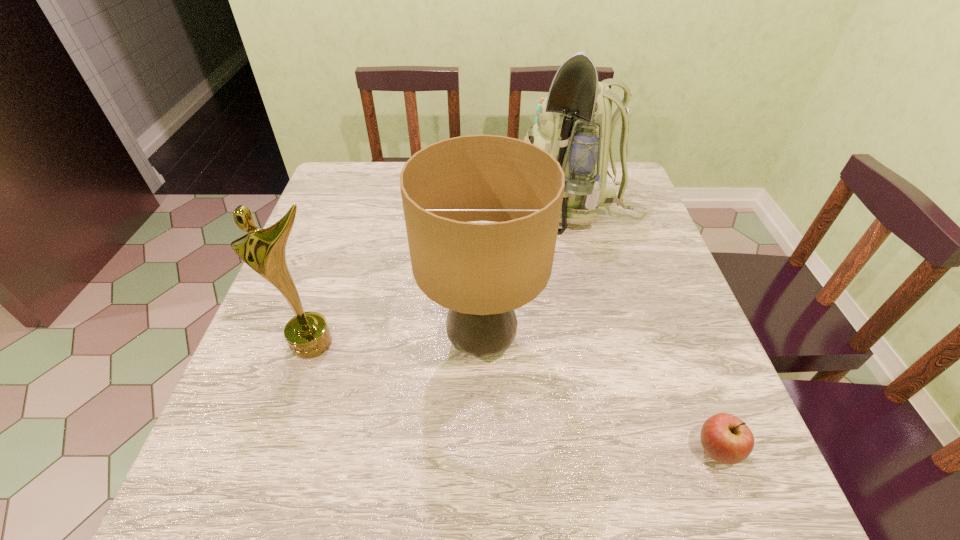
This screenshot has width=960, height=540. In the image, there is a desktop. Find the location of `vacant space at the far left corner`. vacant space at the far left corner is located at coordinates (338, 191).

Locate an element on the screen. vacant space at the far right corner of the desktop is located at coordinates (638, 202).

Locate an element on the screen. The height and width of the screenshot is (540, 960). vacant area at the near right corner of the desktop is located at coordinates (672, 503).

Identify the location of free spot between the leftmost object and the nearest object. (515, 397).

The width and height of the screenshot is (960, 540). Identify the location of empty space between the nearest object and the leftmost object. [515, 397].

Identify the location of vacant space that's between the lampshade and the nearest object. (599, 396).

Identify the location of vacant area that lies between the leftmost object and the lampshade. (397, 342).

Identify the location of free spot between the award and the nearest object. click(x=515, y=397).

Locate an element on the screen. The width and height of the screenshot is (960, 540). the second closest object to the nearest object is located at coordinates (575, 125).

Choose which object is the third nearest neighbor to the backpack. Please provide its 2D coordinates. Your answer should be formatted as a tuple, i.e. [(x, y)], where the tuple contains the x and y coordinates of a point satisfying the conditions above.

[(725, 438)]